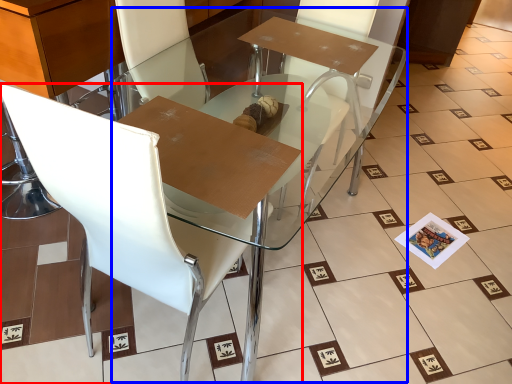
Question: Among these objects, which one is nearest to the camera, chair (highlighted by a red box) or round table (highlighted by a blue box)?

Choices:
 (A) chair
 (B) round table

Answer: (A)